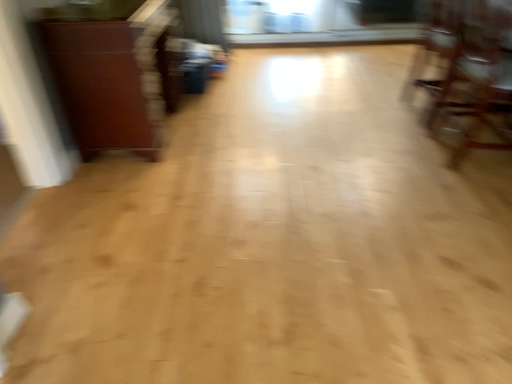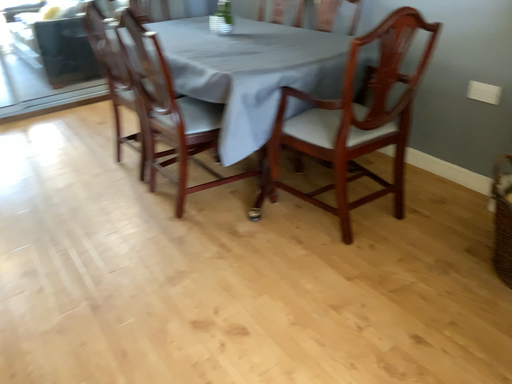
Question: Which way did the camera rotate in the video?

Choices:
 (A) rotated downward
 (B) rotated upward

Answer: (B)